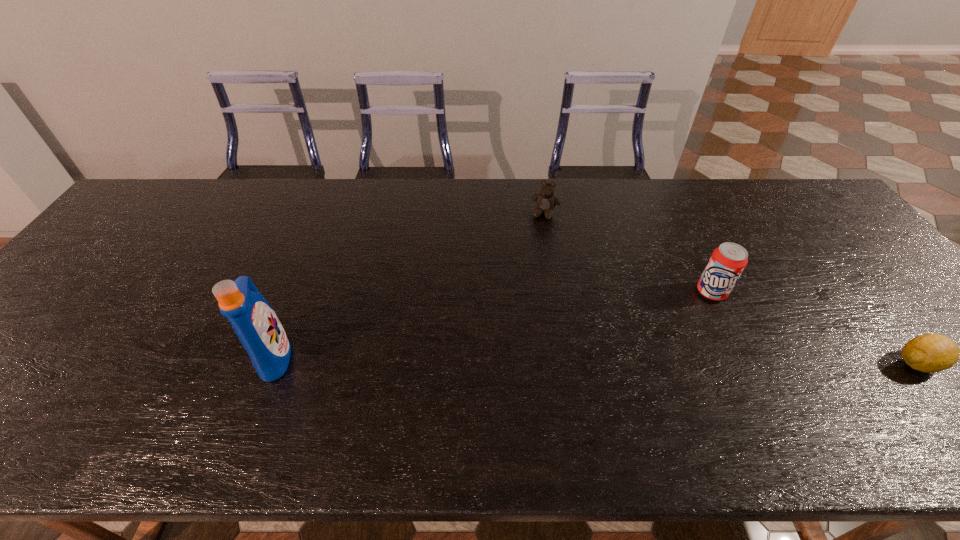
The height and width of the screenshot is (540, 960). What are the coordinates of `free spot on the desktop that is between the leftmost object and the rightmost object and is positioned on the face of the farthest object` in the screenshot? It's located at (501, 358).

At what (x,y) coordinates should I click in order to perform the action: click on vacant space on the desktop that is between the tallest object and the lemon and is positioned on the surface of the third shortest object. Please return your answer as a coordinate pair (x, y). Looking at the image, I should click on (656, 360).